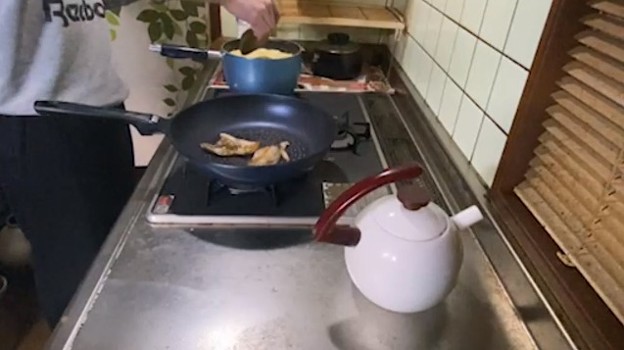
This screenshot has height=350, width=624. In order to click on pot in this screenshot , I will do `click(405, 274)`.